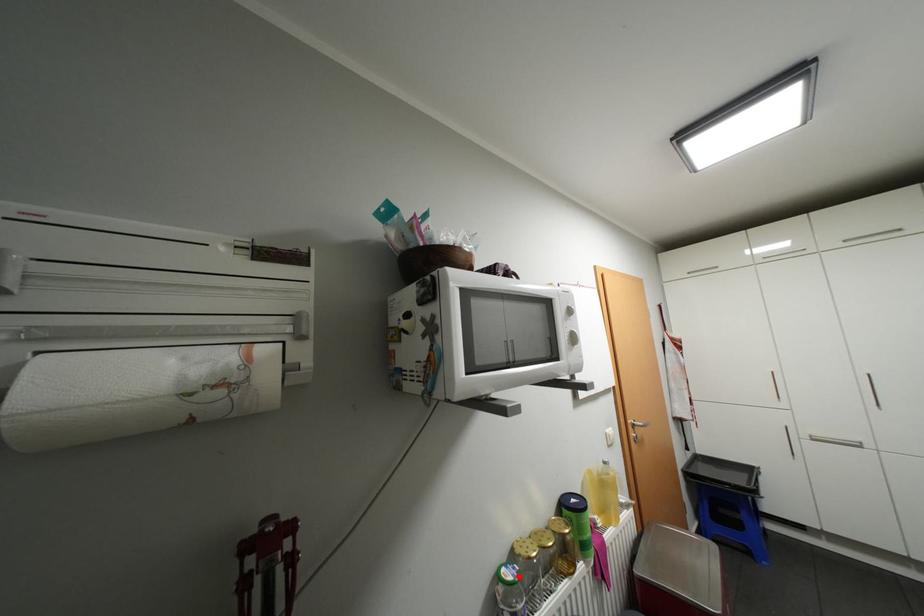
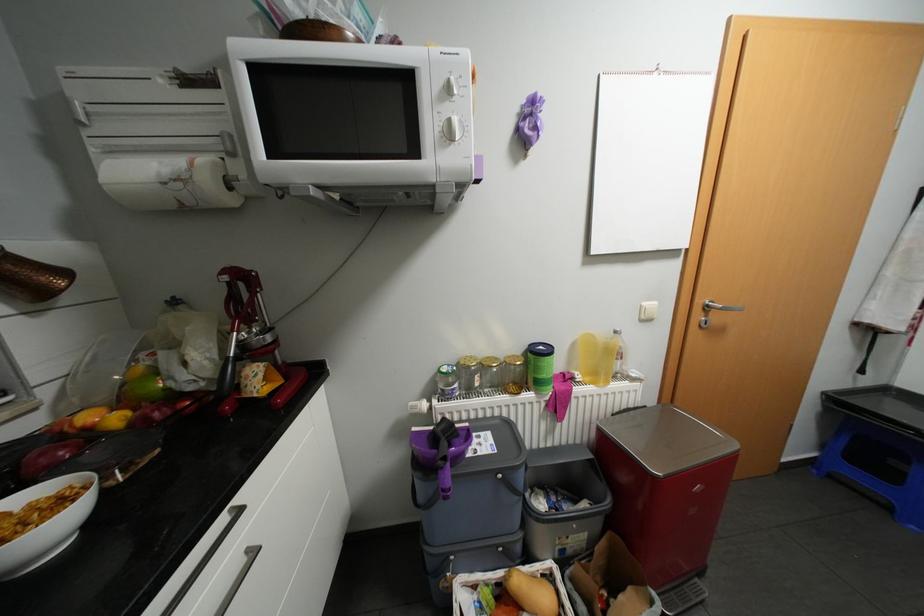
Where in the second image is the point corresponding to the highlighted location from the first image?

(452, 369)